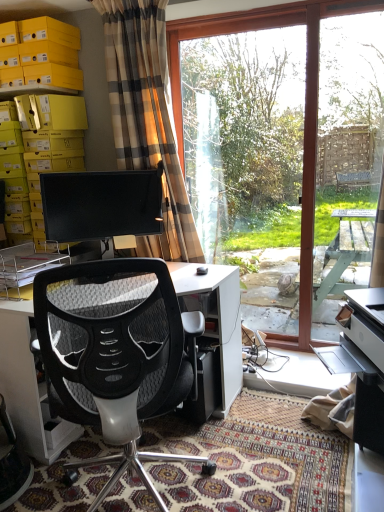
Question: Should I look upward or downward to see yellow cardboard boxes at upper left?

Choices:
 (A) up
 (B) down

Answer: (A)

Question: Does black glossy monitor at center appear on the left side of transparent glass window at center?

Choices:
 (A) yes
 (B) no

Answer: (A)

Question: From a real-world perspective, is black glossy monitor at center beneath transparent glass window at center?

Choices:
 (A) no
 (B) yes

Answer: (B)

Question: Can you confirm if black glossy monitor at center is shorter than transparent glass window at center?

Choices:
 (A) no
 (B) yes

Answer: (B)

Question: Is the depth of black glossy monitor at center greater than that of transparent glass window at center?

Choices:
 (A) no
 (B) yes

Answer: (A)

Question: From a real-world perspective, is black glossy monitor at center positioned over transparent glass window at center based on gravity?

Choices:
 (A) no
 (B) yes

Answer: (A)

Question: Is transparent glass window at center at the back of black glossy monitor at center?

Choices:
 (A) yes
 (B) no

Answer: (B)

Question: Is yellow cardboard boxes at upper left closer to the viewer compared to transparent glass screen door at right?

Choices:
 (A) yes
 (B) no

Answer: (B)

Question: From the image's perspective, would you say yellow cardboard boxes at upper left is shown under transparent glass screen door at right?

Choices:
 (A) no
 (B) yes

Answer: (A)

Question: Is yellow cardboard boxes at upper left not inside transparent glass screen door at right?

Choices:
 (A) yes
 (B) no

Answer: (A)

Question: From a real-world perspective, does yellow cardboard boxes at upper left sit lower than transparent glass screen door at right?

Choices:
 (A) yes
 (B) no

Answer: (B)

Question: Are yellow cardboard boxes at upper left and transparent glass screen door at right located far from each other?

Choices:
 (A) yes
 (B) no

Answer: (A)

Question: Can you confirm if yellow cardboard boxes at upper left is bigger than transparent glass screen door at right?

Choices:
 (A) no
 (B) yes

Answer: (B)

Question: From the image's perspective, is black glossy monitor at center over yellow cardboard boxes at upper left?

Choices:
 (A) yes
 (B) no

Answer: (B)